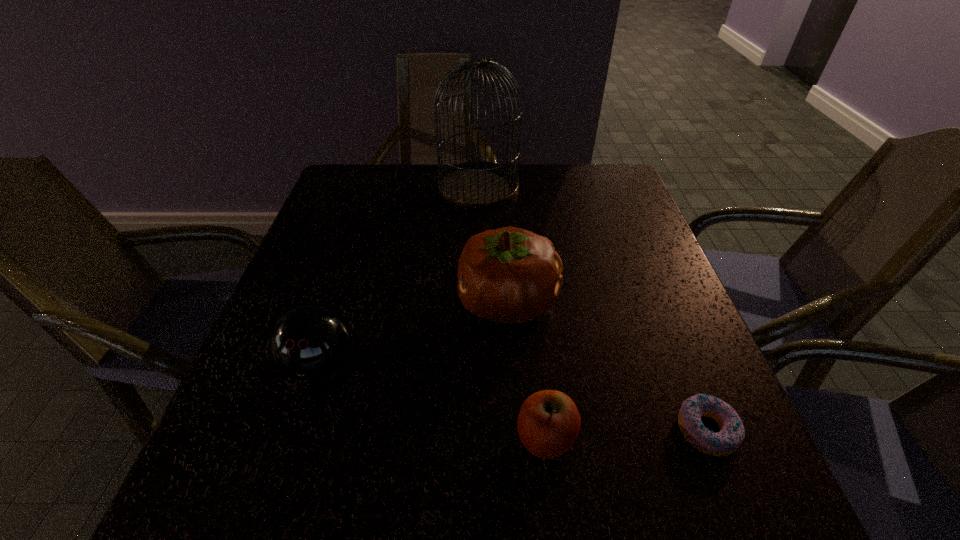
This screenshot has width=960, height=540. I want to click on vacant area in the image that satisfies the following two spatial constraints: 1. on the surface of the apple near the finger holes; 2. on the right side of the bowling ball, so click(298, 438).